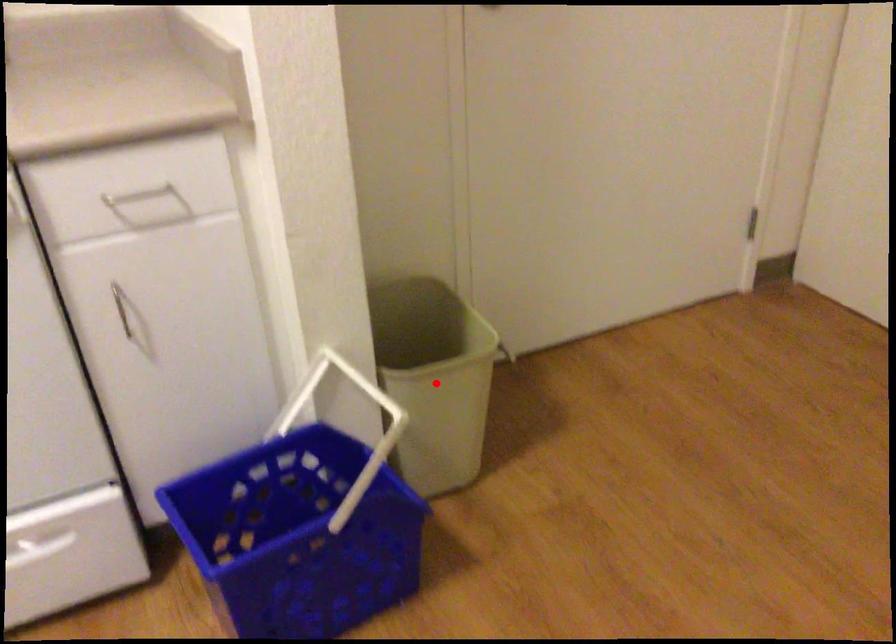
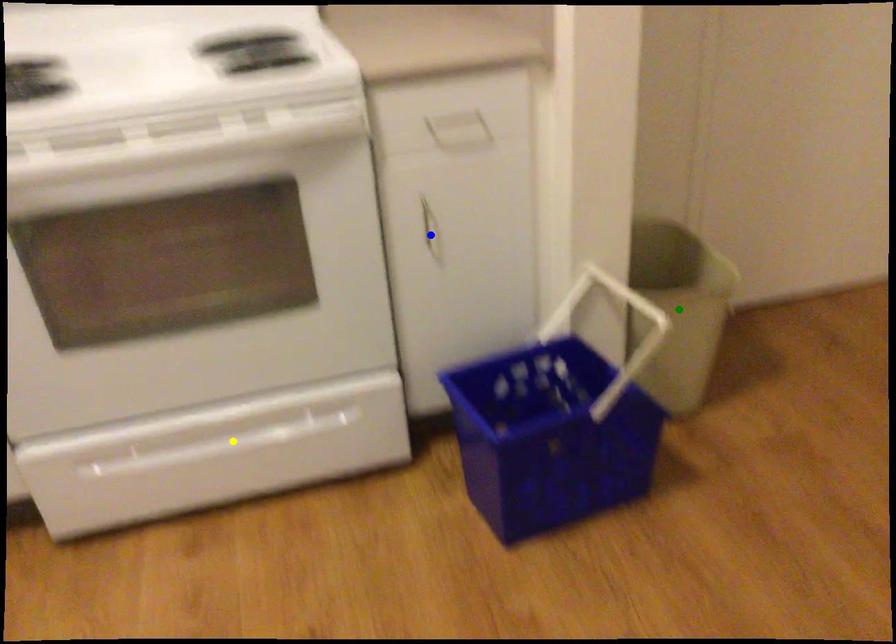
Question: I am providing you with two images of the same scene from different viewpoints. A red point is marked on the first image. You are given multiple points on the second image. Can you choose the point in image 2 that corresponds to the point in image 1?

Choices:
 (A) blue point
 (B) green point
 (C) yellow point

Answer: (B)